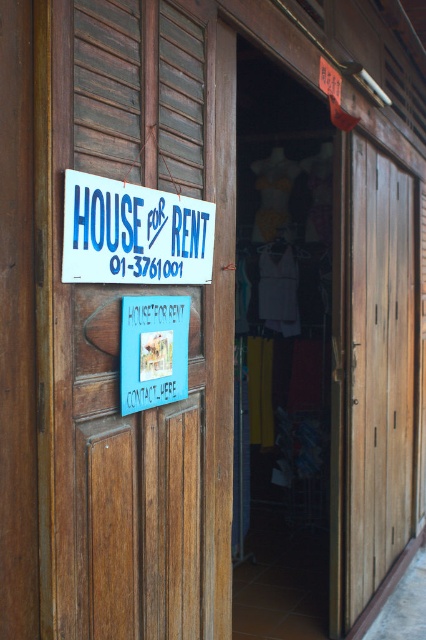
Question: Which of these objects is positioned farthest from the white plastic sign at upper left?

Choices:
 (A) wooden door at left
 (B) brown wooden door at right

Answer: (B)

Question: Where is wooden door at left located in relation to brown wooden door at right in the image?

Choices:
 (A) right
 (B) left

Answer: (B)

Question: Does wooden door at left appear over white plastic sign at upper left?

Choices:
 (A) no
 (B) yes

Answer: (A)

Question: In this image, where is wooden door at left located relative to white plastic sign at upper left?

Choices:
 (A) right
 (B) left

Answer: (A)

Question: Which object is closer to the camera taking this photo?

Choices:
 (A) wooden door at left
 (B) white plastic sign at upper left

Answer: (A)

Question: Which point is closer to the camera?

Choices:
 (A) brown wooden door at right
 (B) white plastic sign at upper left

Answer: (B)